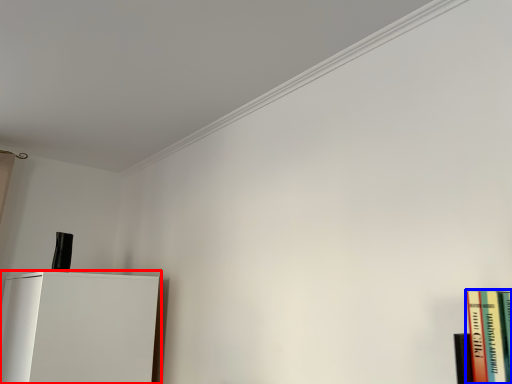
Question: Which object is closer to the camera taking this photo, furniture (highlighted by a red box) or book (highlighted by a blue box)?

Choices:
 (A) furniture
 (B) book

Answer: (B)